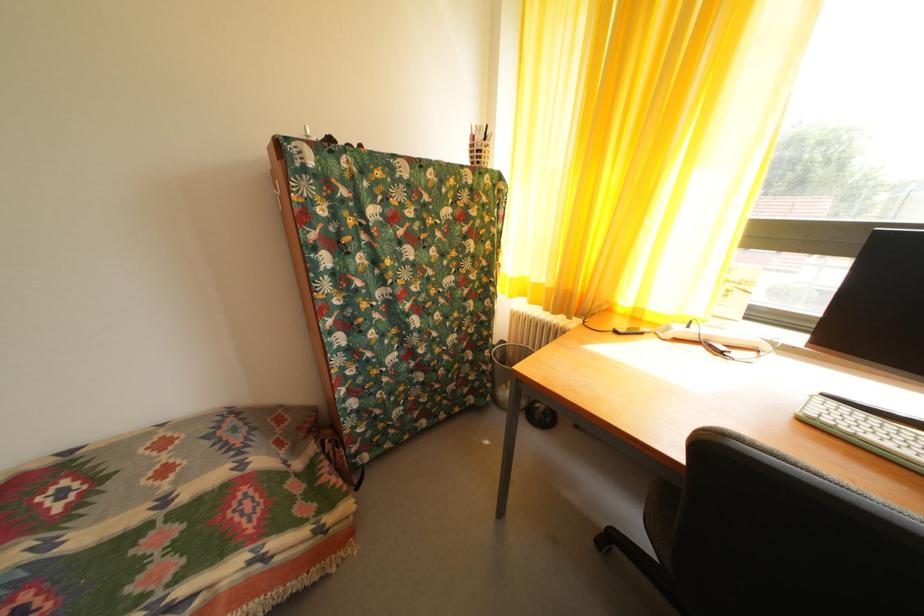
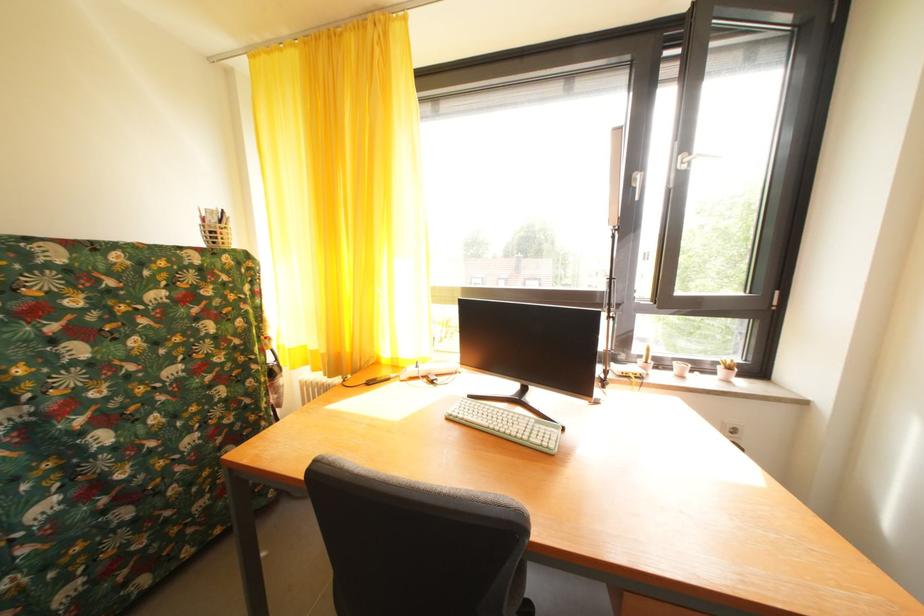
Find the pixel in the second image that matches (833,403) in the first image.

(479, 402)